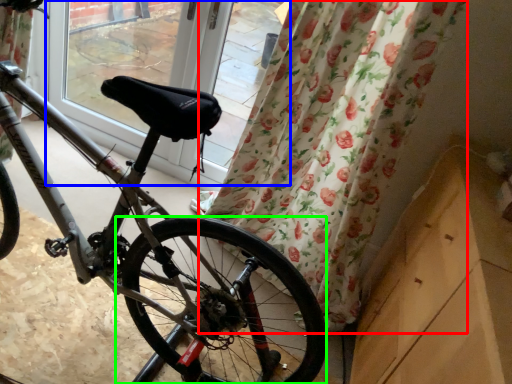
Question: Which object is positioned closest to curtain (highlighted by a red box)? Select from window screen (highlighted by a blue box) and wheel (highlighted by a green box).

Choices:
 (A) window screen
 (B) wheel

Answer: (B)